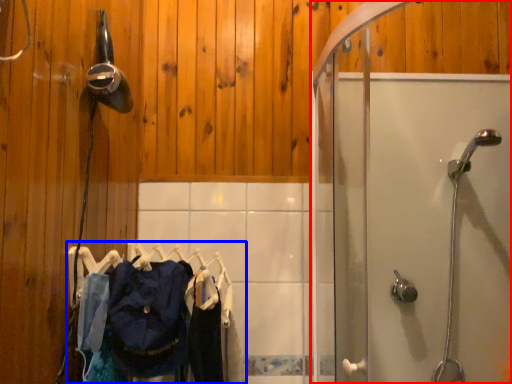
Question: Which object appears closest to the camera in this image, screen door (highlighted by a red box) or laundry (highlighted by a blue box)?

Choices:
 (A) screen door
 (B) laundry

Answer: (A)